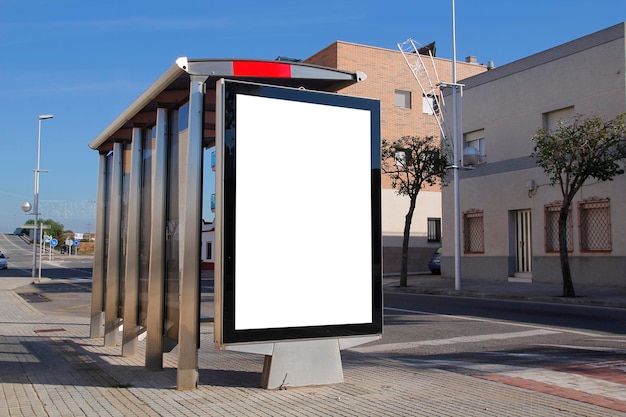
What are the coordinates of `chimney` in the screenshot? It's located at (469, 57).